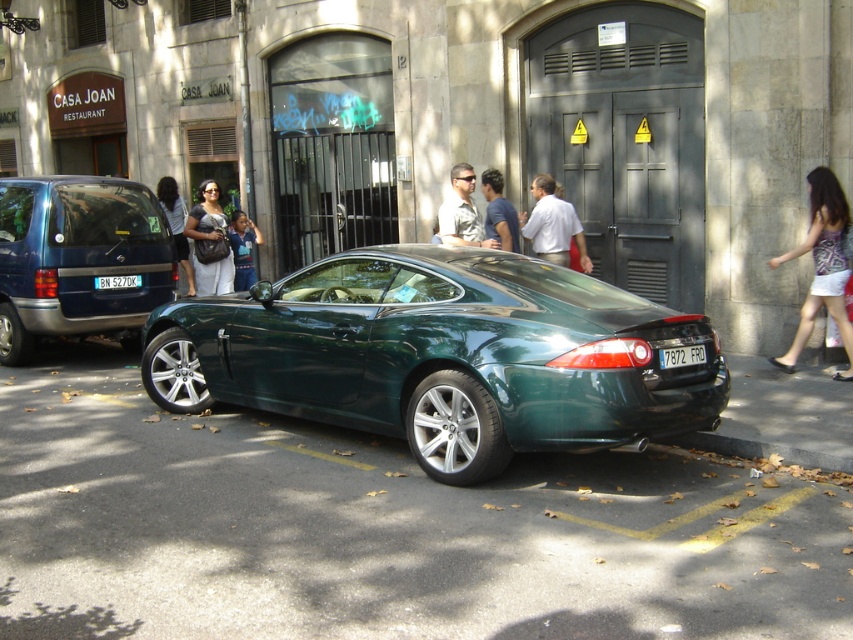
Question: Which point is farther to the camera?

Choices:
 (A) (115, 282)
 (B) (202, 186)
 (C) (694, 353)

Answer: (B)

Question: Does matte black jacket at center appear on the left side of black plastic license plate at rear?

Choices:
 (A) no
 (B) yes

Answer: (B)

Question: Among these objects, which one is nearest to the camera?

Choices:
 (A) metallic blue minivan at left
 (B) black plastic license plate at center

Answer: (A)

Question: Which point is farther to the camera?

Choices:
 (A) matte black dress at center
 (B) metallic blue minivan at left
 (C) matte black camera at center
 (D) black plastic license plate at center

Answer: (C)

Question: Is matte green car at center below black plastic license plate at center?

Choices:
 (A) yes
 (B) no

Answer: (B)

Question: Can you confirm if matte black dress at center is bigger than matte khaki shirt at center?

Choices:
 (A) no
 (B) yes

Answer: (B)